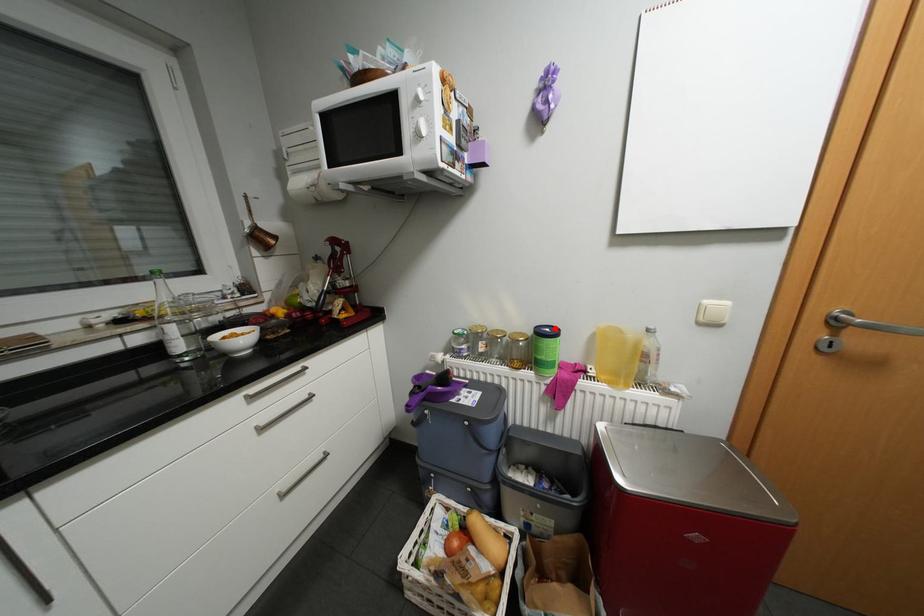
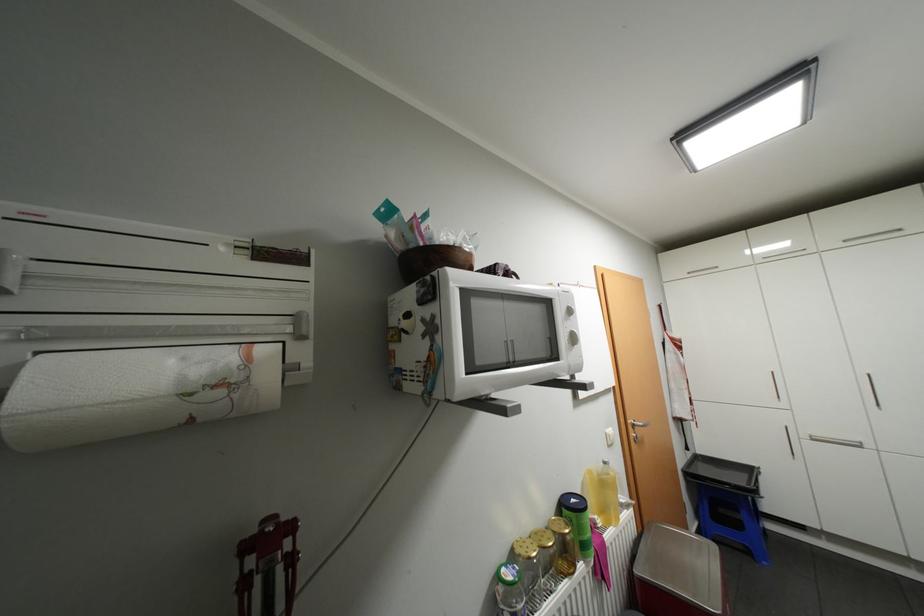
Locate, in the second image, the point that corresponds to the highlighted location in the first image.

(580, 499)